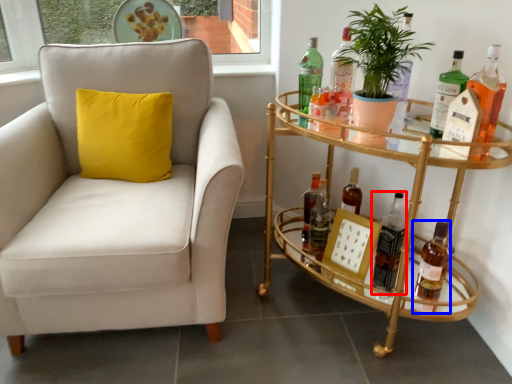
Question: Which object appears closest to the camera in this image, bottle (highlighted by a red box) or bottle (highlighted by a blue box)?

Choices:
 (A) bottle
 (B) bottle

Answer: (B)